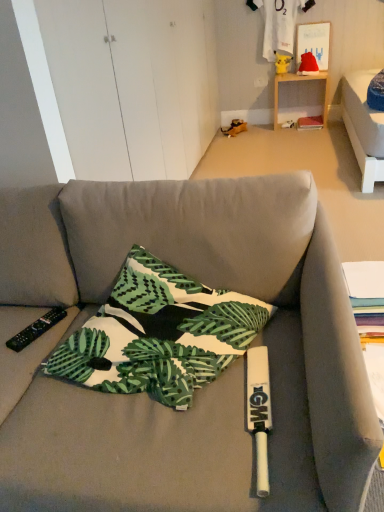
Question: Is white cotton t-shirt at upper center positioned in front of printed fabric pillow at center?

Choices:
 (A) no
 (B) yes

Answer: (A)

Question: Is white cotton t-shirt at upper center in contact with printed fabric pillow at center?

Choices:
 (A) yes
 (B) no

Answer: (B)

Question: Does white cotton t-shirt at upper center lie behind printed fabric pillow at center?

Choices:
 (A) yes
 (B) no

Answer: (A)

Question: Does white cotton t-shirt at upper center have a lesser width compared to printed fabric pillow at center?

Choices:
 (A) yes
 (B) no

Answer: (A)

Question: Does white cotton t-shirt at upper center appear on the right side of printed fabric pillow at center?

Choices:
 (A) yes
 (B) no

Answer: (A)

Question: Is point (41, 331) closer or farther from the camera than point (309, 76)?

Choices:
 (A) farther
 (B) closer

Answer: (B)

Question: Considering the relative positions of black plastic remote control at lower left and wooden shelf at upper right in the image provided, is black plastic remote control at lower left to the left or to the right of wooden shelf at upper right?

Choices:
 (A) right
 (B) left

Answer: (B)

Question: From a real-world perspective, is black plastic remote control at lower left physically located above or below wooden shelf at upper right?

Choices:
 (A) below
 (B) above

Answer: (B)

Question: From the image's perspective, is black plastic remote control at lower left above or below wooden shelf at upper right?

Choices:
 (A) below
 (B) above

Answer: (A)

Question: In terms of width, does black plastic remote control at lower left look wider or thinner when compared to printed fabric pillow at center?

Choices:
 (A) thin
 (B) wide

Answer: (A)

Question: In the image, is black plastic remote control at lower left positioned in front of or behind printed fabric pillow at center?

Choices:
 (A) behind
 (B) front

Answer: (A)

Question: In terms of size, does black plastic remote control at lower left appear bigger or smaller than printed fabric pillow at center?

Choices:
 (A) big
 (B) small

Answer: (B)

Question: Is black plastic remote control at lower left spatially inside printed fabric pillow at center, or outside of it?

Choices:
 (A) inside
 (B) outside

Answer: (B)

Question: Is wooden shelf at upper right wider or thinner than black plastic remote control at lower left?

Choices:
 (A) wide
 (B) thin

Answer: (A)

Question: Considering their positions, is wooden shelf at upper right located in front of or behind black plastic remote control at lower left?

Choices:
 (A) front
 (B) behind

Answer: (B)